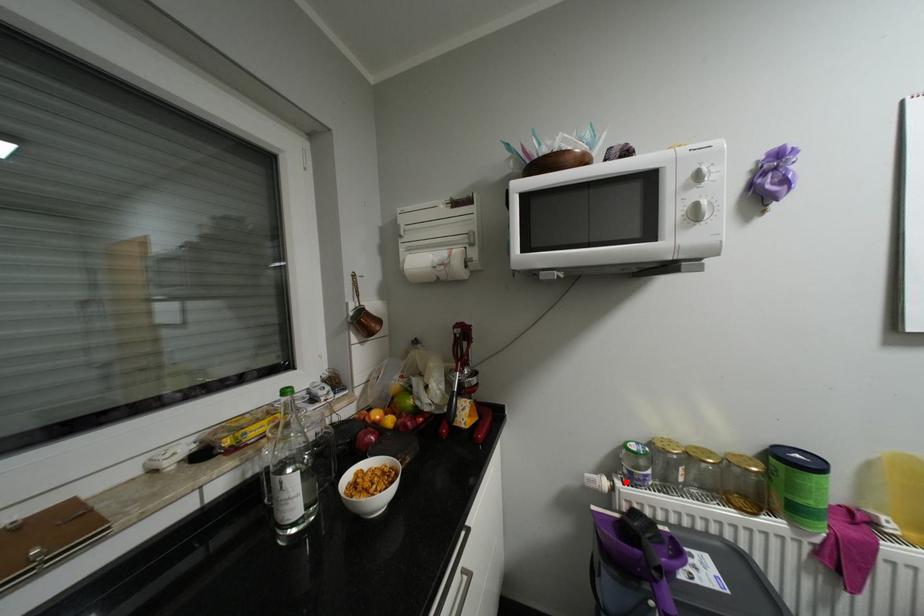
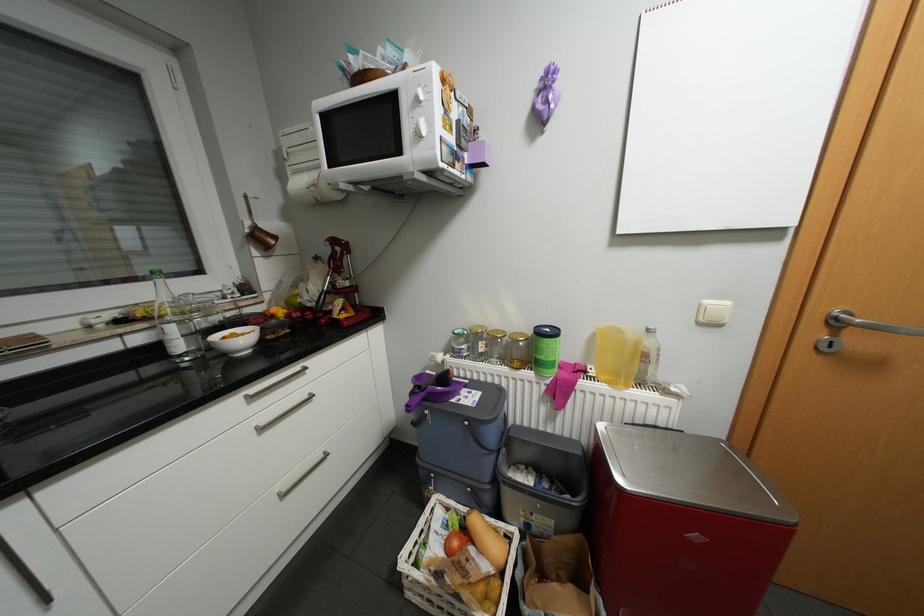
The point at the highlighted location is marked in the first image. Where is the corresponding point in the second image?

(456, 355)